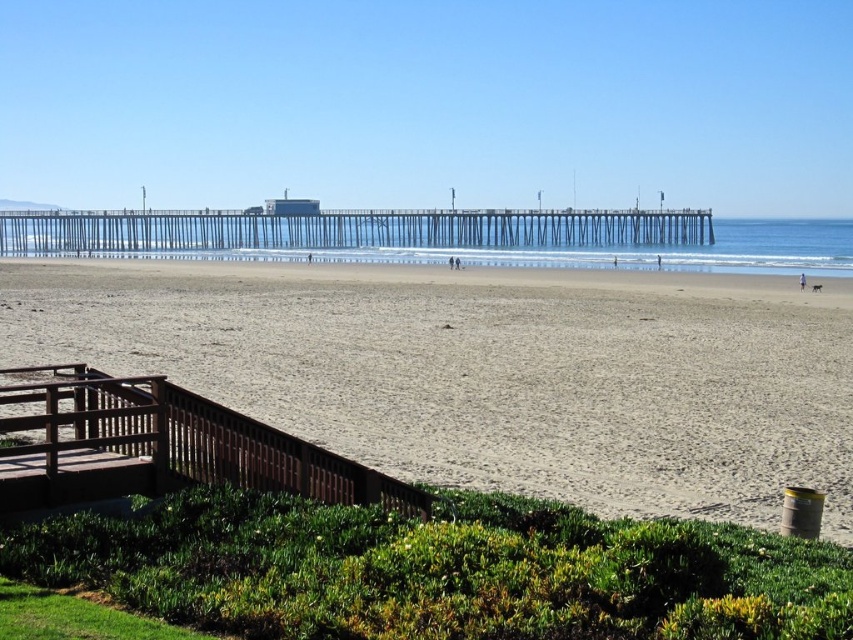
Question: Is the position of light brown sand at center more distant than that of metallic gray pier at center?

Choices:
 (A) yes
 (B) no

Answer: (B)

Question: Which point is farther from the camera taking this photo?

Choices:
 (A) (213, 218)
 (B) (277, 442)
 (C) (630, 428)

Answer: (A)

Question: Estimate the real-world distances between objects in this image. Which object is farther from the light brown sand at center?

Choices:
 (A) metallic gray pier at center
 (B) brown wooden stairs at lower left

Answer: (A)

Question: Does brown wooden stairs at lower left have a greater width compared to metallic gray pier at center?

Choices:
 (A) no
 (B) yes

Answer: (A)

Question: Considering the real-world distances, which object is farthest from the metallic gray pier at center?

Choices:
 (A) light brown sand at center
 (B) brown wooden stairs at lower left

Answer: (B)

Question: Can you confirm if brown wooden stairs at lower left is thinner than metallic gray pier at center?

Choices:
 (A) yes
 (B) no

Answer: (A)